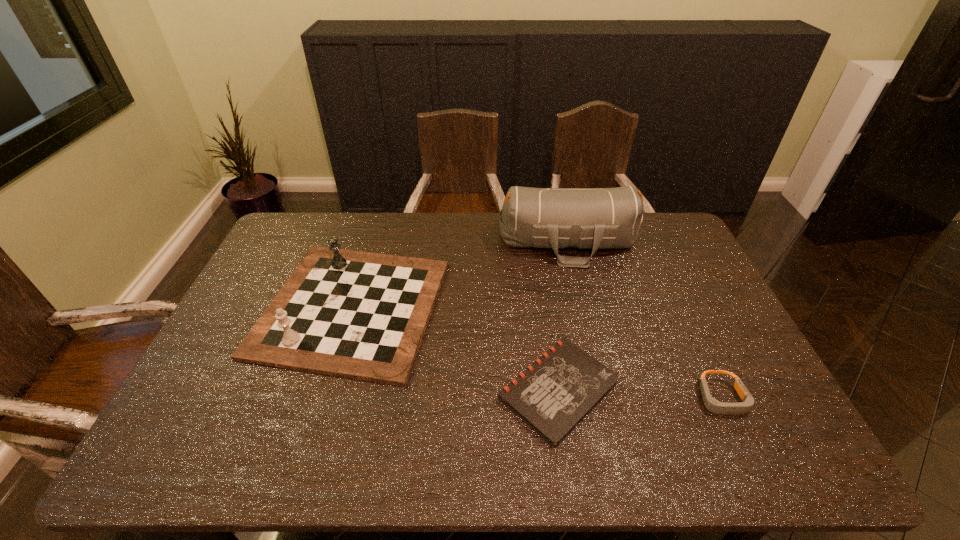
Identify the location of free spot between the duffel bag and the notebook. (564, 316).

At what (x,y) coordinates should I click in order to perform the action: click on vacant space in between the leftmost object and the duffel bag. Please return your answer as a coordinate pair (x, y). Looking at the image, I should click on (460, 274).

Identify the location of free space that is in between the leftmost object and the duffel bag. The height and width of the screenshot is (540, 960). (460, 274).

I want to click on empty space that is in between the third tallest object and the notebook, so click(x=640, y=394).

I want to click on vacant space that's between the duffel bag and the second tallest object, so click(460, 274).

Identify the location of free space between the tallest object and the notebook. The width and height of the screenshot is (960, 540). point(564,316).

Where is `empty location between the gameboard and the goggles`? The height and width of the screenshot is (540, 960). empty location between the gameboard and the goggles is located at coordinates tap(537, 353).

This screenshot has height=540, width=960. What are the coordinates of `vacant region between the goggles and the duffel bag` in the screenshot? It's located at (645, 320).

Identify which object is located as the second nearest to the duffel bag. Please provide its 2D coordinates. Your answer should be formatted as a tuple, i.e. [(x, y)], where the tuple contains the x and y coordinates of a point satisfying the conditions above.

[(553, 395)]

Choose which object is the nearest neighbor to the duffel bag. Please provide its 2D coordinates. Your answer should be formatted as a tuple, i.e. [(x, y)], where the tuple contains the x and y coordinates of a point satisfying the conditions above.

[(360, 315)]